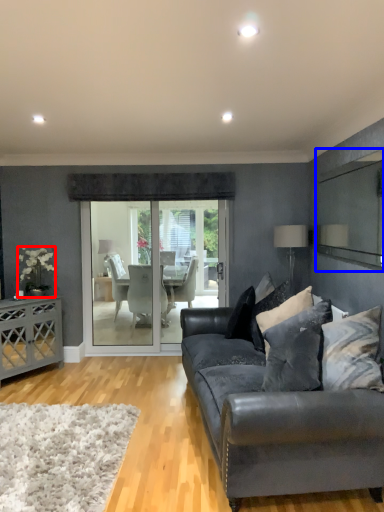
Question: Which point is closer to the camera, flower (highlighted by a red box) or mirror (highlighted by a blue box)?

Choices:
 (A) flower
 (B) mirror

Answer: (B)